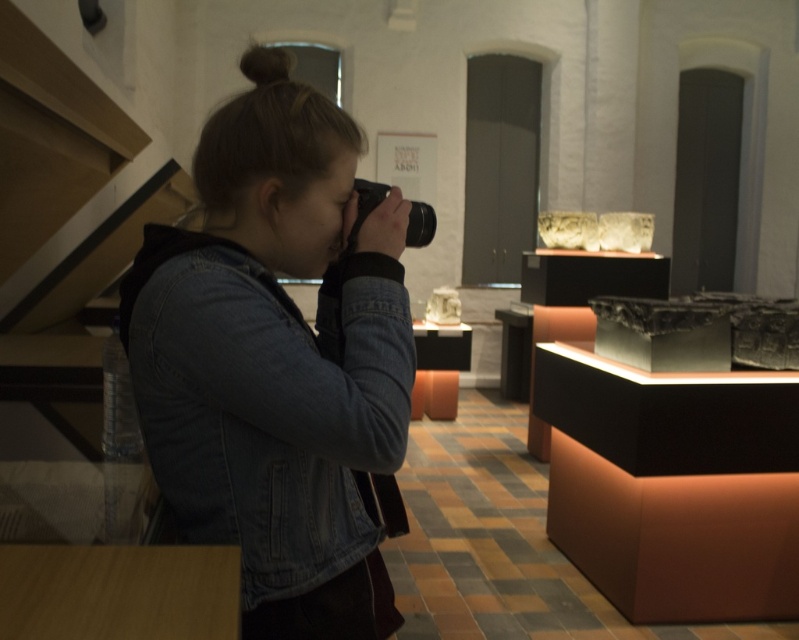
Question: Considering the relative positions of denim jacket at center and black plastic camera at center in the image provided, where is denim jacket at center located with respect to black plastic camera at center?

Choices:
 (A) right
 (B) left

Answer: (B)

Question: Which of the following is the farthest from the observer?

Choices:
 (A) (406, 228)
 (B) (161, 429)

Answer: (A)

Question: Which of the following is the closest to the observer?

Choices:
 (A) (277, 406)
 (B) (360, 220)

Answer: (A)

Question: Which point is closer to the camera taking this photo?

Choices:
 (A) (423, 204)
 (B) (380, 356)

Answer: (B)

Question: Is denim jacket at center bigger than black plastic camera at center?

Choices:
 (A) yes
 (B) no

Answer: (A)

Question: Does denim jacket at center appear over black plastic camera at center?

Choices:
 (A) no
 (B) yes

Answer: (A)